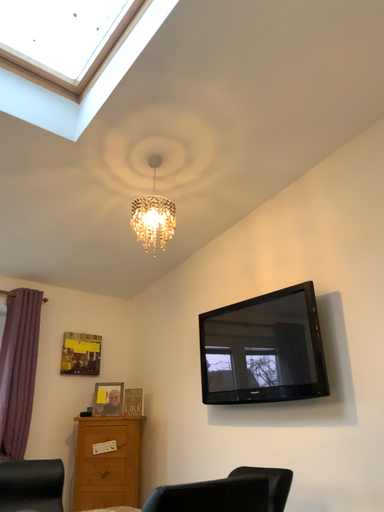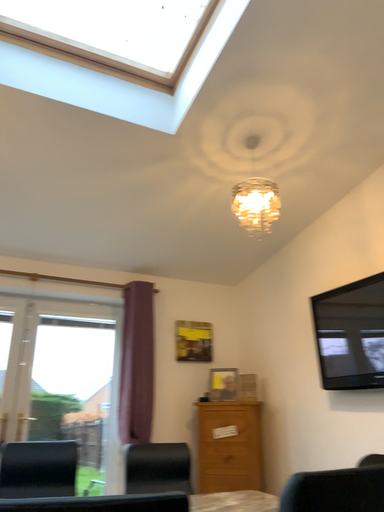
Question: Which way did the camera rotate in the video?

Choices:
 (A) rotated right
 (B) rotated left

Answer: (B)